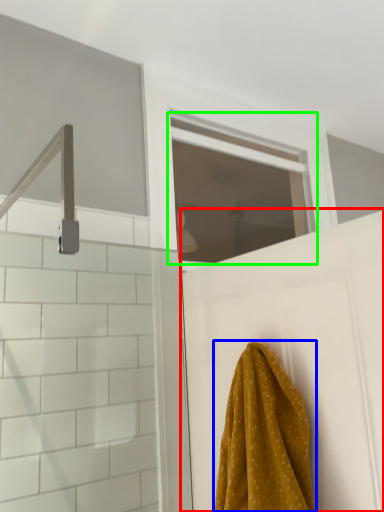
Question: Based on their relative distances, which object is nearer to door (highlighted by a red box)? Choose from towel (highlighted by a blue box) and window (highlighted by a green box).

Choices:
 (A) towel
 (B) window

Answer: (A)